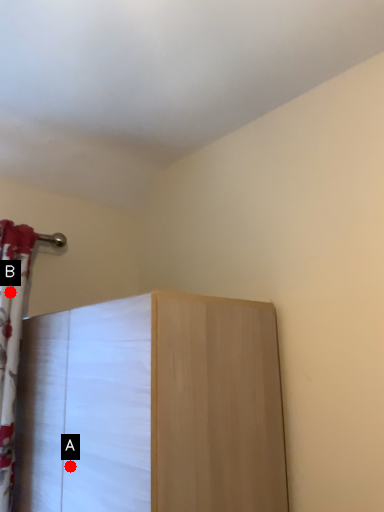
Question: Two points are circled on the image, labeled by A and B beside each circle. Which point is closer to the camera?

Choices:
 (A) A is closer
 (B) B is closer

Answer: (A)